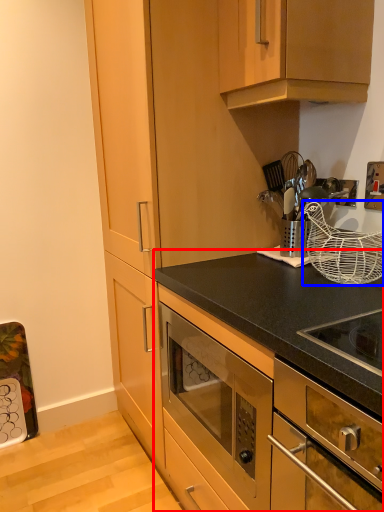
Question: Which point is further to the camera, cabinetry (highlighted by a red box) or basket (highlighted by a blue box)?

Choices:
 (A) cabinetry
 (B) basket

Answer: (B)